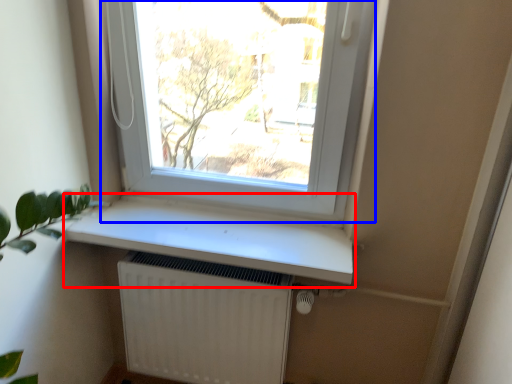
Question: Which of the following is the farthest to the observer, window sill (highlighted by a red box) or window (highlighted by a blue box)?

Choices:
 (A) window sill
 (B) window

Answer: (A)